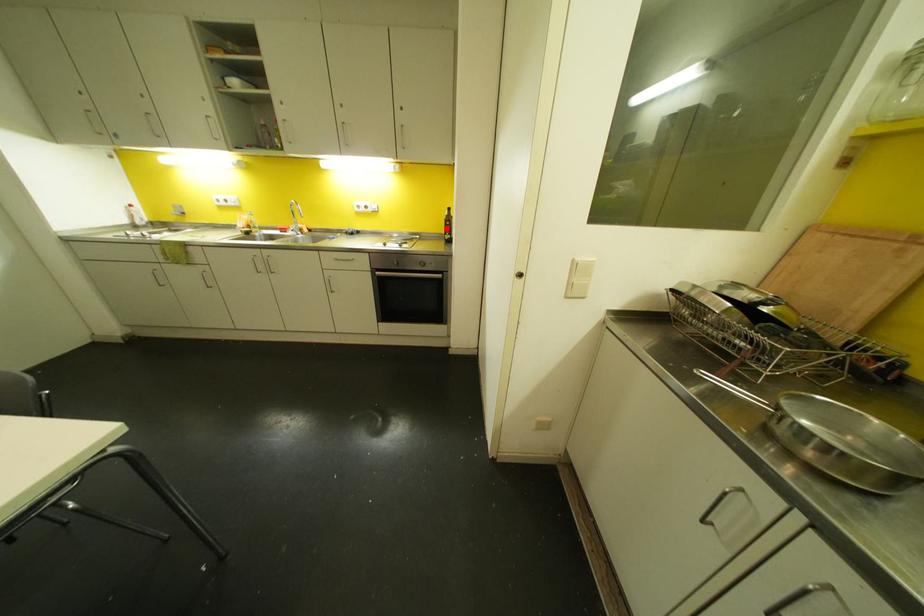
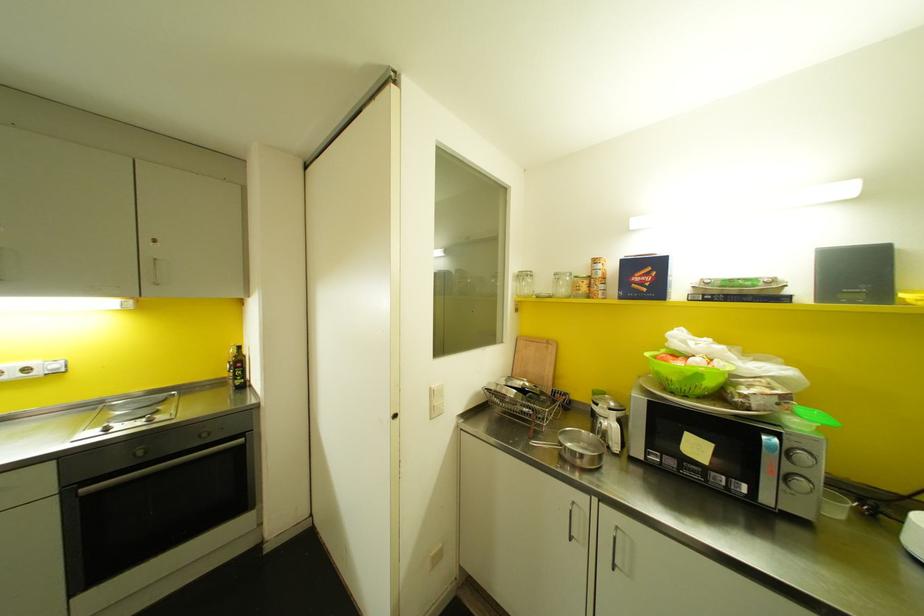
Find the pixel in the second image that matches the highlighted location in the first image.

(237, 371)